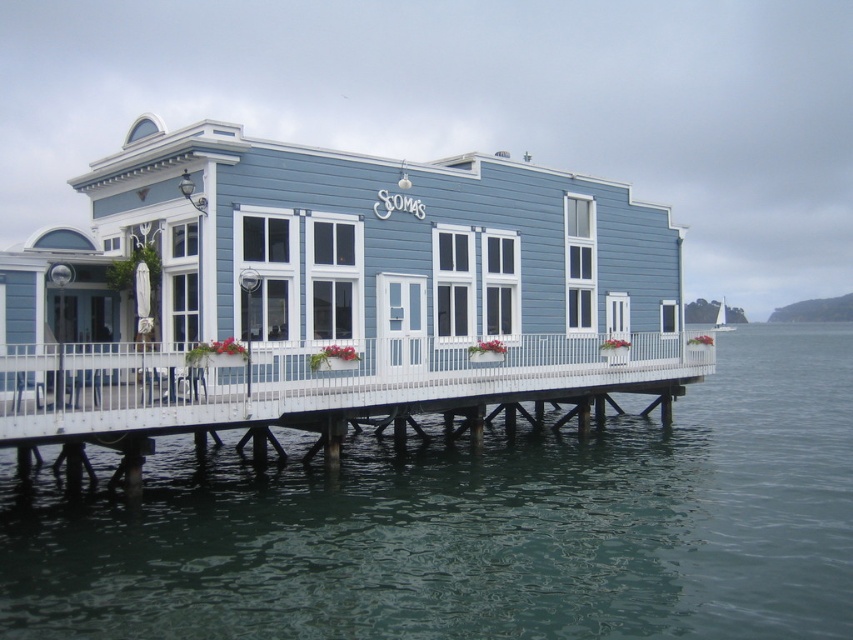
Question: Which point is closer to the camera?

Choices:
 (A) (374, 595)
 (B) (106, 392)

Answer: (A)

Question: Which point appears closest to the camera in this image?

Choices:
 (A) (325, 396)
 (B) (677, 595)

Answer: (B)

Question: Does transparent water at lower center have a lesser width compared to white wooden dock at lower center?

Choices:
 (A) no
 (B) yes

Answer: (A)

Question: Is transparent water at lower center to the right of white wooden dock at lower center from the viewer's perspective?

Choices:
 (A) no
 (B) yes

Answer: (B)

Question: Which object is closer to the camera taking this photo?

Choices:
 (A) transparent water at lower center
 (B) white wooden dock at lower center

Answer: (A)

Question: Does transparent water at lower center lie behind white wooden dock at lower center?

Choices:
 (A) no
 (B) yes

Answer: (A)